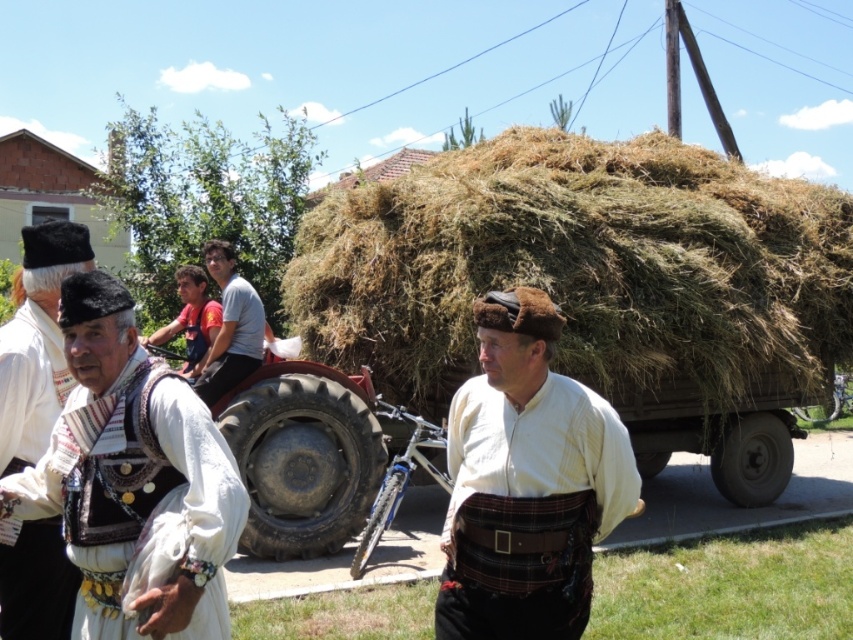
Question: Estimate the real-world distances between objects in this image. Which object is farther from the red fabric shirt at center?

Choices:
 (A) white embroidered vest at center
 (B) light gray cotton shirt at center

Answer: (A)

Question: Does brown dry hay at center have a greater width compared to red shirt at center?

Choices:
 (A) yes
 (B) no

Answer: (A)

Question: Which point is closer to the camera?

Choices:
 (A) red shirt at center
 (B) white leather vest at center
 (C) light gray cotton shirt at center

Answer: (B)

Question: Considering the relative positions of brown dry hay at center and white woven shirt at center in the image provided, where is brown dry hay at center located with respect to white woven shirt at center?

Choices:
 (A) above
 (B) below

Answer: (A)

Question: Based on their relative distances, which object is nearer to the red fabric shirt at center?

Choices:
 (A) red shirt at center
 (B) white leather vest at center
 (C) white woven shirt at center
 (D) brown dry hay at center

Answer: (A)

Question: Is white woven shirt at center smaller than red shirt at center?

Choices:
 (A) yes
 (B) no

Answer: (B)